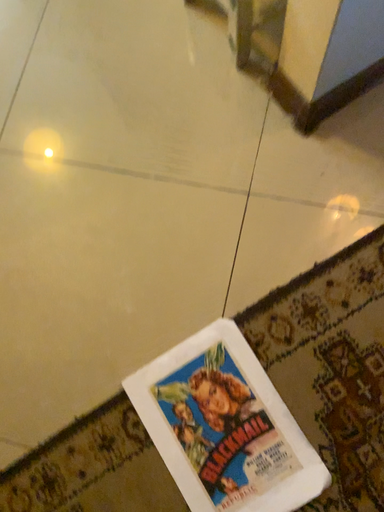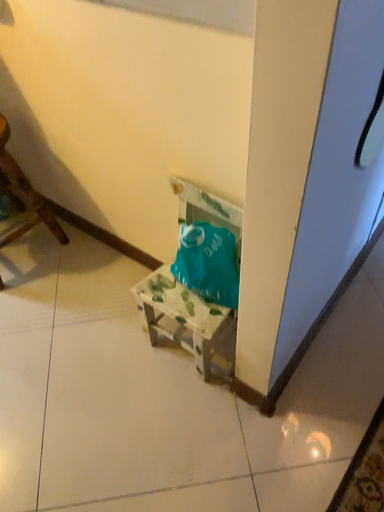
Question: Which way did the camera rotate in the video?

Choices:
 (A) rotated right
 (B) rotated left

Answer: (A)